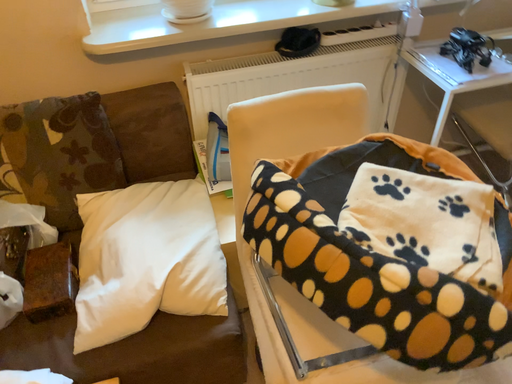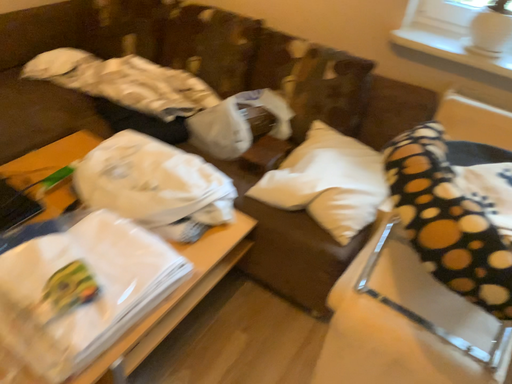
Question: How did the camera likely rotate when shooting the video?

Choices:
 (A) rotated upward
 (B) rotated downward

Answer: (A)